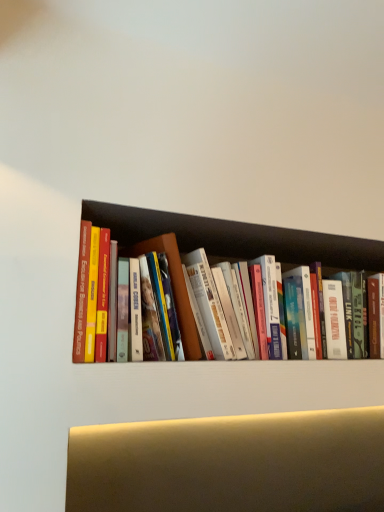
What do you see at coordinates (213, 252) in the screenshot?
I see `hardcover books at center` at bounding box center [213, 252].

The width and height of the screenshot is (384, 512). I want to click on hardcover books at center, so click(213, 252).

I want to click on hardcover books at center, so click(213, 252).